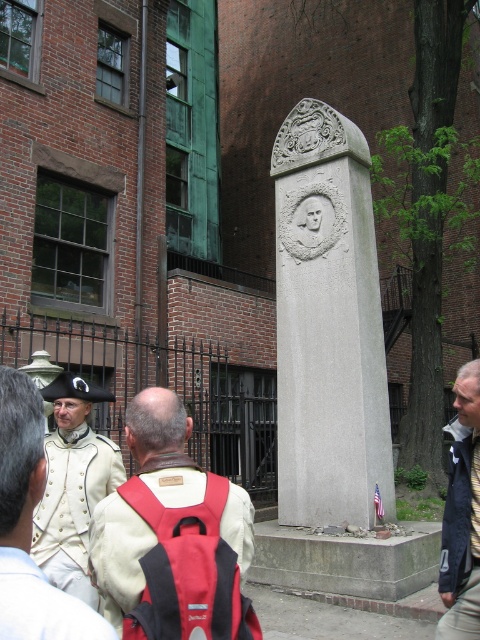
You are a photographer positioned to the right of the monument. You want to capture both the white matte uniform at center and the blue striped tie at center in the same frame. Based on their positions, which direction should you move to ensure both are visible?

Since the white matte uniform at center is to the left of the blue striped tie at center, you should move to your left to include both in the frame.

You are attending a historical reenactment event and notice two items worn by the central figure in the image. The items are the white matte uniform at center and the blue striped tie at center. Which of these two items is bigger in size?

The white matte uniform at center is larger in size compared to the blue striped tie at center.